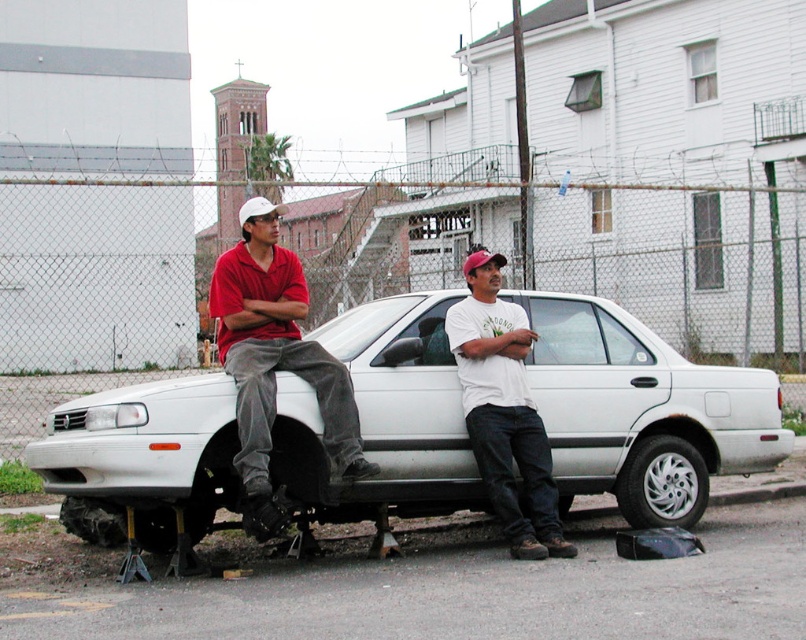
Consider the image. Which is more to the right, white matte sedan at center or white matte car at center?

white matte sedan at center is more to the right.

Between white matte sedan at center and white matte car at center, which one has more height?

white matte car at center

Is point (275, 461) farther from viewer compared to point (505, 312)?

No, (275, 461) is closer to viewer.

Find the location of a particular element. white matte sedan at center is located at coordinates (642, 412).

From the picture: How far apart are matte red shirt at left and white matte car at center?

matte red shirt at left and white matte car at center are 1.24 meters apart from each other.

Is matte red shirt at left below white matte car at center?

Incorrect, matte red shirt at left is not positioned below white matte car at center.

Between point (235, 342) and point (482, 397), which one is positioned behind?

The point (482, 397) is behind.

This screenshot has width=806, height=640. I want to click on matte red shirt at left, so click(x=273, y=360).

Which is in front, point (566, 499) or point (339, 472)?

Positioned in front is point (339, 472).

Is white matte sedan at center taller than matte red shirt at left?

In fact, white matte sedan at center may be shorter than matte red shirt at left.

Which is behind, point (634, 337) or point (252, 333)?

The point (634, 337) is behind.

This screenshot has width=806, height=640. Find the location of `white matte sedan at center`. white matte sedan at center is located at coordinates (642, 412).